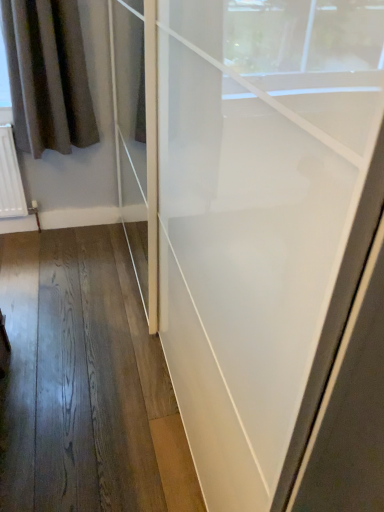
The image size is (384, 512). What do you see at coordinates (48, 76) in the screenshot? I see `brown fabric curtain at left` at bounding box center [48, 76].

At what (x,y) coordinates should I click in order to perform the action: click on brown fabric curtain at left. Please return your answer as a coordinate pair (x, y). The height and width of the screenshot is (512, 384). Looking at the image, I should click on (48, 76).

What is the approximate width of brown fabric curtain at left?

The width of brown fabric curtain at left is 7.63 inches.

Find the location of a particular element. The image size is (384, 512). brown fabric curtain at left is located at coordinates (48, 76).